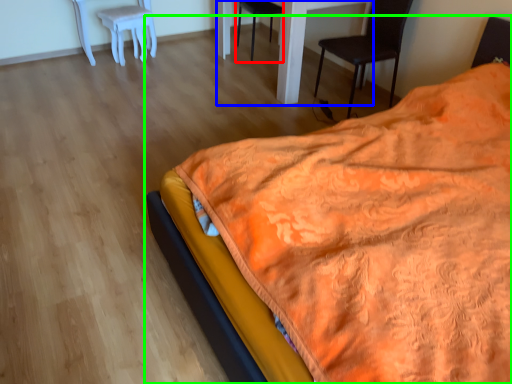
Question: Based on their relative distances, which object is nearer to chair (highlighted by a red box)? Choose from table (highlighted by a blue box) and bed (highlighted by a green box).

Choices:
 (A) table
 (B) bed

Answer: (A)